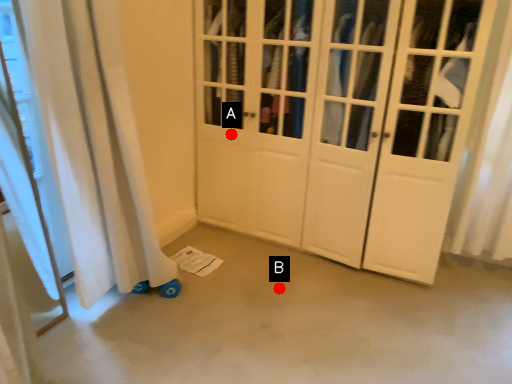
Question: Two points are circled on the image, labeled by A and B beside each circle. Which point is closer to the camera?

Choices:
 (A) A is closer
 (B) B is closer

Answer: (B)